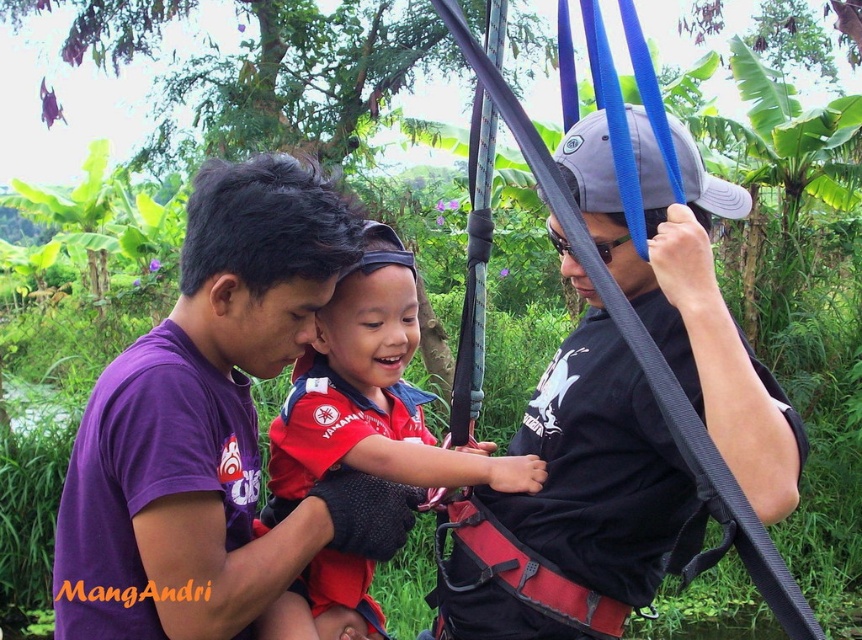
Question: Is purple cotton shirt at center bigger than black fabric harness at center?

Choices:
 (A) yes
 (B) no

Answer: (B)

Question: Which object is the closest to the purple cotton shirt at center?

Choices:
 (A) black fabric harness at center
 (B) red matte life vest at center

Answer: (B)

Question: Is the position of black fabric harness at center more distant than that of red matte life vest at center?

Choices:
 (A) yes
 (B) no

Answer: (B)

Question: Which object is closer to the camera taking this photo?

Choices:
 (A) red matte life vest at center
 (B) purple cotton shirt at center

Answer: (B)

Question: Which point appears farthest from the camera in this image?

Choices:
 (A) (338, 595)
 (B) (264, 282)
 (C) (650, 481)

Answer: (A)

Question: Can you confirm if purple cotton shirt at center is positioned above red matte life vest at center?

Choices:
 (A) no
 (B) yes

Answer: (B)